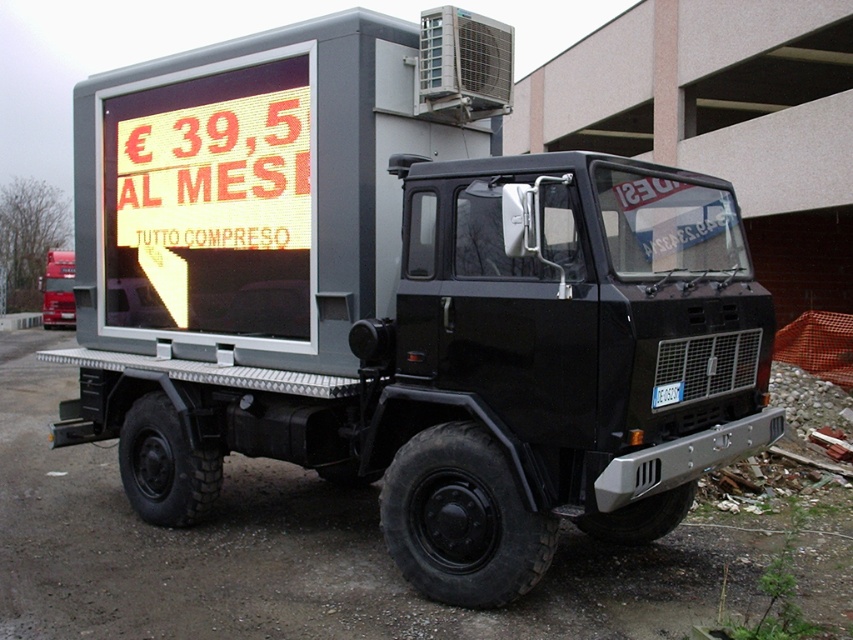
You are standing at the point where the camera is positioned, looking at the black truck parked outdoors. You want to walk directly to the point labeled point (606, 65). How far will you have to walk to reach that point?

The distance between the camera and point (606, 65) is 18.24 meters, so you will have to walk 18.24 meters to reach that point.

You are a delivery driver who needs to park your truck between the concrete wall at center and the yellow led sign at upper left. Can you fit your truck there if your truck is 10 meters long?

The concrete wall at center is larger in size than the yellow led sign at upper left, but the description does not provide information about the distance between them. Therefore, it is impossible to determine if the truck can fit there.

You are a delivery driver who needs to read both the gray matte led display at center and the yellow led sign at upper left on the truck. Which one is closer to you when you are standing in front of the truck?

The gray matte led display at center is closer to you because it is in front of the yellow led sign at upper left.